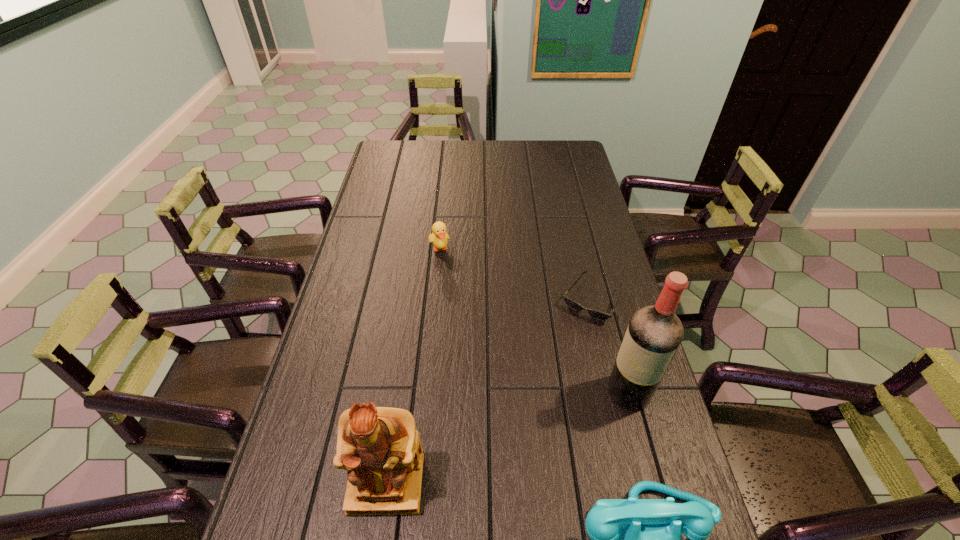
At what (x,y) coordinates should I click in order to perform the action: click on vacant space on the desktop that is between the figurine and the telephone and is positioned on the front-facing side of the third nearest object. Please return your answer as a coordinate pair (x, y). This screenshot has width=960, height=540. Looking at the image, I should click on (546, 514).

I want to click on free space on the desktop that is between the figurine and the telephone and is positioned on the front-facing side of the fourth nearest object, so click(477, 501).

The width and height of the screenshot is (960, 540). I want to click on free spot on the desktop that is between the second tallest object and the telephone and is positioned on the front-facing side of the fourth tallest object, so click(x=534, y=511).